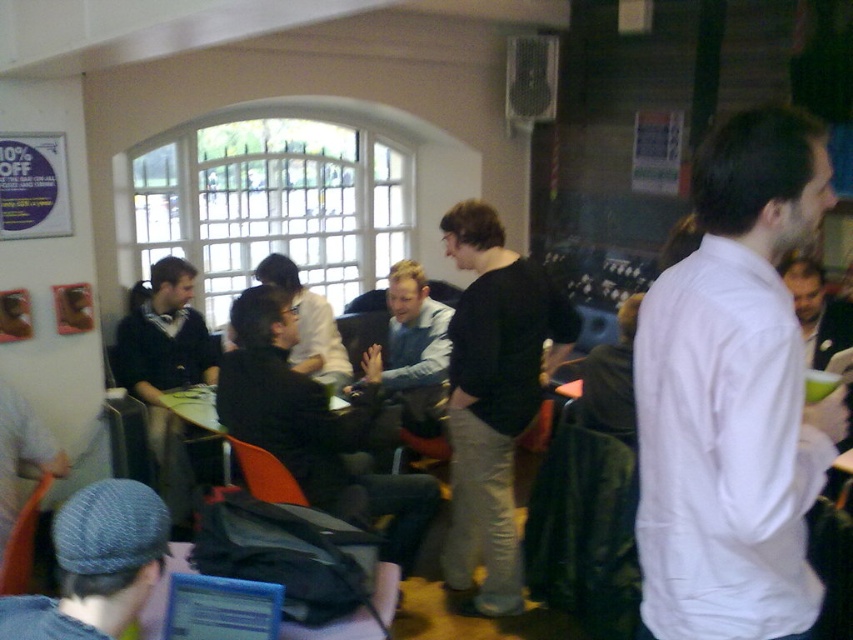
Can you confirm if white smooth shirt at right is positioned above black matte shirt at center?

Yes.

Describe the element at coordinates (732, 396) in the screenshot. I see `white smooth shirt at right` at that location.

Which is behind, point (741, 276) or point (480, 442)?

The point (480, 442) is more distant.

Image resolution: width=853 pixels, height=640 pixels. Find the location of `white smooth shirt at right`. white smooth shirt at right is located at coordinates (732, 396).

Is point (142, 320) positioned behind point (181, 632)?

Yes.

Is point (129, 292) closer to camera compared to point (186, 588)?

No, (129, 292) is behind (186, 588).

Between point (152, 435) and point (187, 609), which one is positioned in front?

Positioned in front is point (187, 609).

At what (x,y) coordinates should I click in order to perform the action: click on matte black jacket at left. Please return your answer as a coordinate pair (x, y). The image size is (853, 640). Looking at the image, I should click on (167, 374).

Measure the distance between dark brown leather jacket at center and camera.

dark brown leather jacket at center and camera are 8.46 feet apart.

Between dark brown leather jacket at center and denim cap at lower left, which one has less height?

denim cap at lower left

This screenshot has width=853, height=640. I want to click on dark brown leather jacket at center, so click(316, 426).